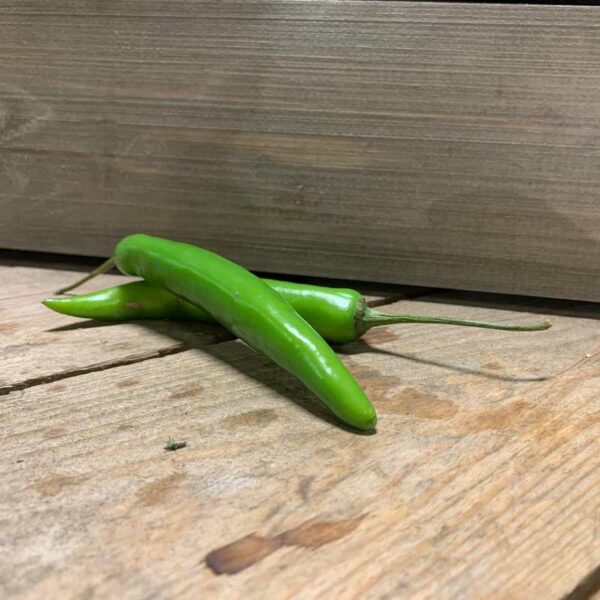
The image size is (600, 600). I want to click on crack between boards on table, so click(42, 376), click(131, 357).